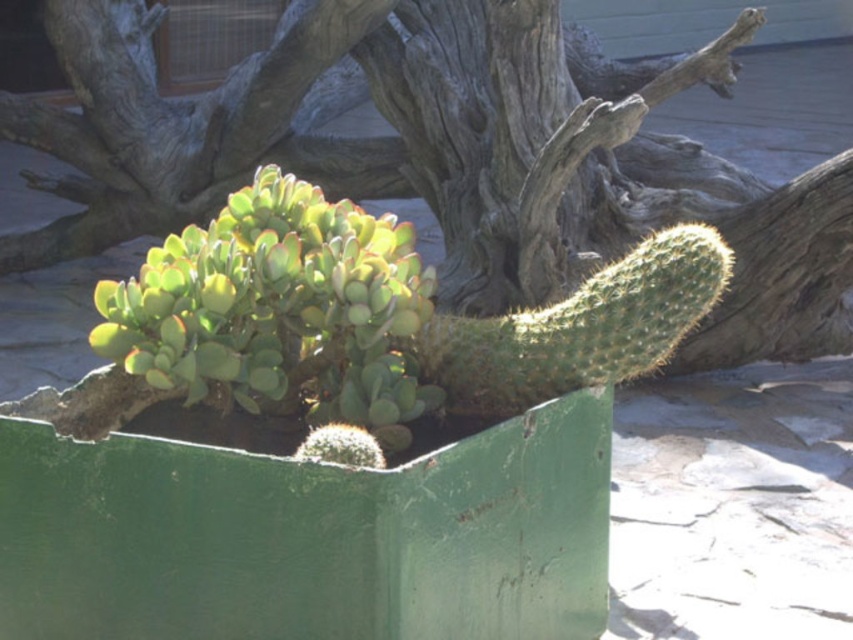
You are standing in front of a succulent plant and want to place a small decorative item exactly at the center of the green painted metal box. Given that the box is represented by the point at coordinates point (308, 536), where should you place the item?

The green painted metal box at center is represented by point (308, 536), so you should place the item exactly at the coordinates point (308, 536) to center it.

You are standing at the origin point of the coordinate system. You want to place a new plant in the green painted metal box at center. What are the coordinates where you should place it?

The coordinates for the green painted metal box at center are at point [308,536]. You should place the new plant at those coordinates.

You are standing in front of the succulent plant and want to place a small decoration on the ground. You have two options for placement marked as point A at coordinates point [144,106] and point B at coordinates point [328,440]. Which point is closer to you?

Point A at coordinates point [144,106] is closer to you because it is further to the viewer than point B at coordinates point [328,440].